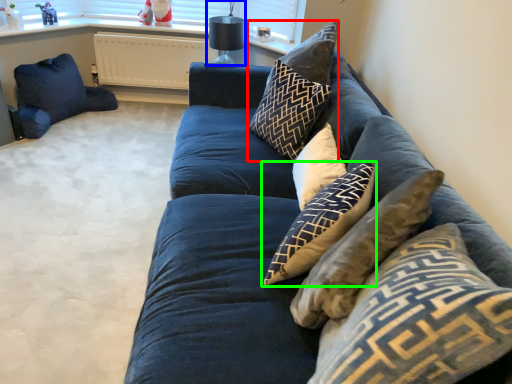
Question: Which object is positioned farthest from pillow (highlighted by a red box)? Select from lamp (highlighted by a blue box) and pillow (highlighted by a green box).

Choices:
 (A) lamp
 (B) pillow

Answer: (A)